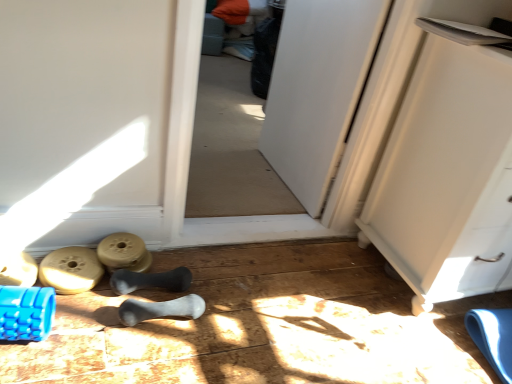
Identify the location of free location to the right of gray rubber bone at center, arranged as the first footwear when viewed from the right. The height and width of the screenshot is (384, 512). (218, 333).